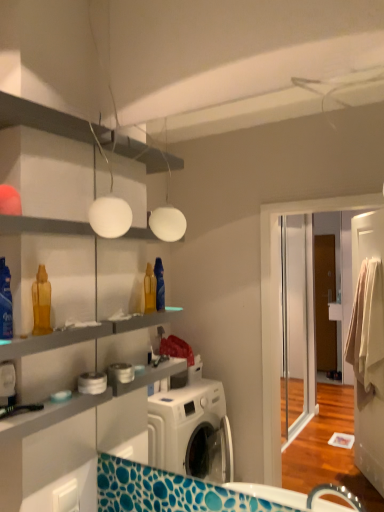
Question: Is translucent plastic bottle at left, arranged as the 2th cleaning product when viewed from the left, not inside white matte globe at upper center?

Choices:
 (A) yes
 (B) no

Answer: (A)

Question: Is white matte globe at upper center at the back of translucent plastic bottle at left, positioned as the 1th cleaning product in right-to-left order?

Choices:
 (A) no
 (B) yes

Answer: (A)

Question: Is translucent plastic bottle at left, positioned as the 1th cleaning product in right-to-left order, further to camera compared to white matte globe at upper center?

Choices:
 (A) yes
 (B) no

Answer: (A)

Question: Could you tell me if translucent plastic bottle at left, the second cleaning product from the front, is turned towards white matte globe at upper center?

Choices:
 (A) yes
 (B) no

Answer: (B)

Question: Would you say translucent plastic bottle at left, the second cleaning product from the front, contains white matte globe at upper center?

Choices:
 (A) no
 (B) yes

Answer: (A)

Question: From a real-world perspective, is translucent plastic bottle at left, the second cleaning product from the front, above or below white matte globe at upper center?

Choices:
 (A) above
 (B) below

Answer: (B)

Question: Is translucent plastic bottle at left, arranged as the 2th cleaning product when viewed from the left, situated inside white matte globe at upper center or outside?

Choices:
 (A) outside
 (B) inside

Answer: (A)

Question: Considering the relative positions of translucent plastic bottle at left, the second cleaning product from the front, and white matte globe at upper center in the image provided, is translucent plastic bottle at left, the second cleaning product from the front, to the left or to the right of white matte globe at upper center?

Choices:
 (A) left
 (B) right

Answer: (A)

Question: From their relative heights in the image, would you say translucent plastic bottle at left, acting as the first cleaning product starting from the back, is taller or shorter than white matte globe at upper center?

Choices:
 (A) short
 (B) tall

Answer: (A)

Question: Is translucent plastic bottle at left, arranged as the 2th cleaning product when viewed from the left, spatially inside translucent plastic spray bottle at left, placed as the first cleaning product when sorted from left to right, or outside of it?

Choices:
 (A) inside
 (B) outside

Answer: (B)

Question: Is translucent plastic bottle at left, acting as the first cleaning product starting from the back, in front of or behind translucent plastic spray bottle at left, placed as the first cleaning product when sorted from left to right, in the image?

Choices:
 (A) front
 (B) behind

Answer: (B)

Question: Is translucent plastic bottle at left, positioned as the 1th cleaning product in right-to-left order, taller or shorter than translucent plastic spray bottle at left, the second cleaning product viewed from the right?

Choices:
 (A) short
 (B) tall

Answer: (A)

Question: Considering the positions of translucent plastic bottle at left, the second cleaning product from the front, and translucent plastic spray bottle at left, the 1th cleaning product when ordered from front to back, in the image, is translucent plastic bottle at left, the second cleaning product from the front, wider or thinner than translucent plastic spray bottle at left, the 1th cleaning product when ordered from front to back,?

Choices:
 (A) thin
 (B) wide

Answer: (B)

Question: Is translucent plastic spray bottle at left, the second cleaning product viewed from the right, inside or outside of translucent plastic bottle at left, acting as the first cleaning product starting from the back?

Choices:
 (A) outside
 (B) inside

Answer: (A)

Question: Considering the positions of translucent plastic spray bottle at left, the 1th cleaning product when ordered from front to back, and translucent plastic bottle at left, positioned as the 1th cleaning product in right-to-left order, in the image, is translucent plastic spray bottle at left, the 1th cleaning product when ordered from front to back, bigger or smaller than translucent plastic bottle at left, positioned as the 1th cleaning product in right-to-left order,?

Choices:
 (A) small
 (B) big

Answer: (B)